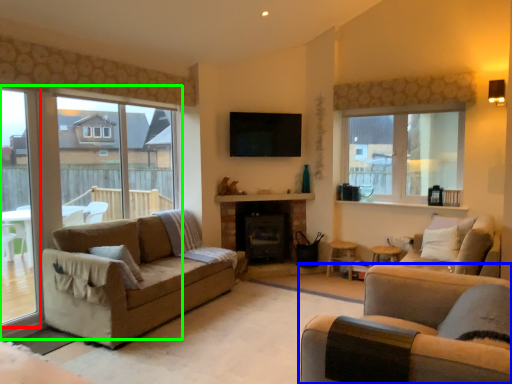
Question: Considering the real-world distances, which object is closest to window frame (highlighted by a red box)? studio couch (highlighted by a blue box) or window (highlighted by a green box).

Choices:
 (A) studio couch
 (B) window

Answer: (B)